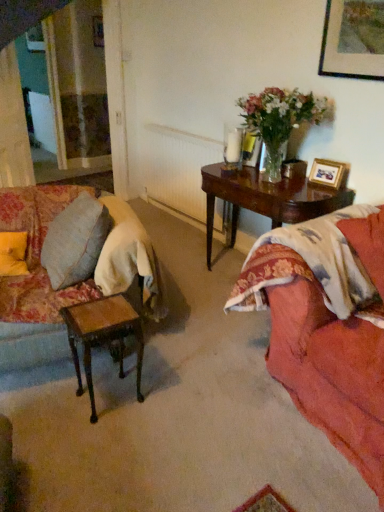
Question: From a real-world perspective, relative to white textured radiator at center, is velvet floral couch at left vertically above or below?

Choices:
 (A) above
 (B) below

Answer: (B)

Question: From the image's perspective, is velvet floral couch at left above or below white textured radiator at center?

Choices:
 (A) above
 (B) below

Answer: (B)

Question: Estimate the real-world distances between objects in this image. Which object is closer to the floral fabric bedspread at right?

Choices:
 (A) white textured radiator at center
 (B) wooden picture frame at upper right
 (C) translucent glass vase at upper right
 (D) light beige fabric curtain at left
 (E) shiny dark wood table at center

Answer: (E)

Question: Considering the real-world distances, which object is closest to the wooden side table at lower left?

Choices:
 (A) wooden picture frame at upper right
 (B) shiny dark wood table at center
 (C) light beige fabric curtain at left
 (D) translucent glass vase at upper right
 (E) floral fabric bedspread at right

Answer: (E)